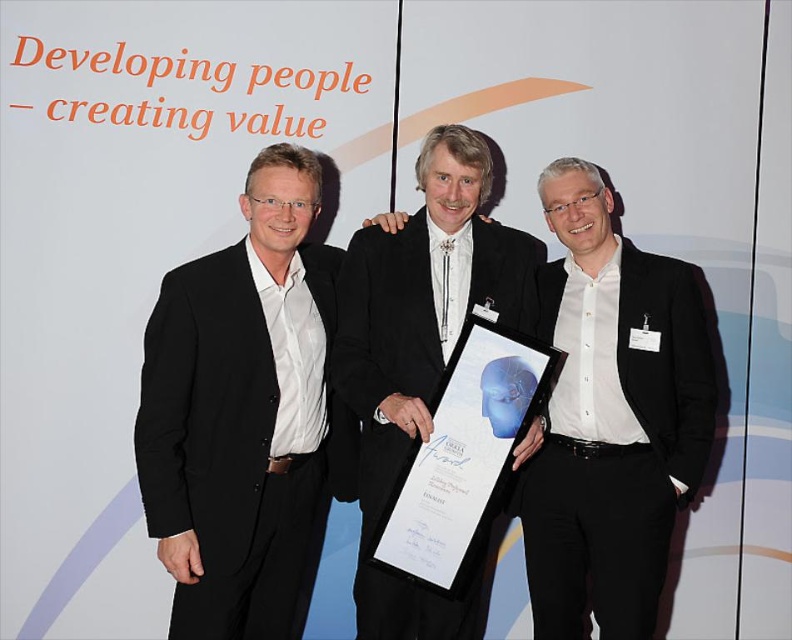
Question: In this image, where is matte black suit at left located relative to white glossy shirt at center?

Choices:
 (A) below
 (B) above

Answer: (A)

Question: Does white glossy shirt at center appear on the right side of black satin suit at center?

Choices:
 (A) yes
 (B) no

Answer: (A)

Question: Among these points, which one is farthest from the camera?

Choices:
 (A) (355, 266)
 (B) (157, 474)
 (C) (642, 586)

Answer: (C)

Question: Which point appears closest to the camera in this image?

Choices:
 (A) (286, 161)
 (B) (360, 592)

Answer: (A)

Question: Is white glossy shirt at center wider than black satin suit at center?

Choices:
 (A) yes
 (B) no

Answer: (B)

Question: Among these points, which one is nearest to the camera?

Choices:
 (A) (189, 625)
 (B) (566, 282)

Answer: (A)